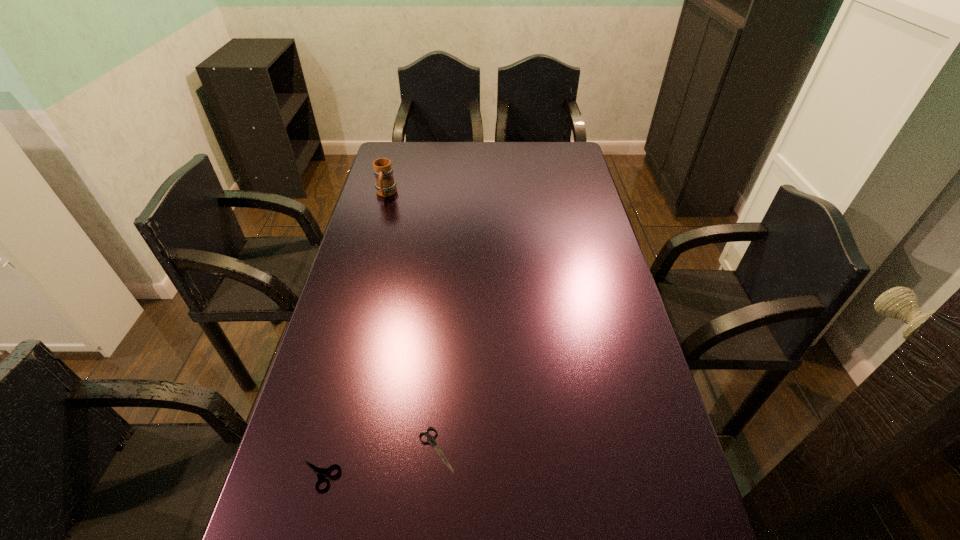
Where is `free location that satisfies the following two spatial constraints: 1. on the side of the taller shears with the handle; 2. on the left side of the farthest object`? free location that satisfies the following two spatial constraints: 1. on the side of the taller shears with the handle; 2. on the left side of the farthest object is located at coordinates (309, 476).

Identify the location of vacant space that satisfies the following two spatial constraints: 1. on the side of the farthest object with the handle; 2. on the right side of the shortest object. (316, 449).

Identify the location of free region that satisfies the following two spatial constraints: 1. on the side of the farthest object with the handle; 2. on the left side of the right shears. The height and width of the screenshot is (540, 960). (316, 449).

Where is `vacant point that satisfies the following two spatial constraints: 1. on the side of the tallest object with the handle; 2. on the left side of the right shears`? vacant point that satisfies the following two spatial constraints: 1. on the side of the tallest object with the handle; 2. on the left side of the right shears is located at coordinates (316, 449).